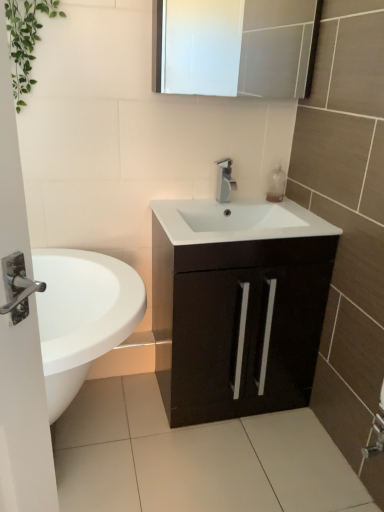
What do you see at coordinates (234, 47) in the screenshot?
I see `white glossy medicine cabinet at upper center` at bounding box center [234, 47].

Describe the element at coordinates (276, 185) in the screenshot. I see `translucent plastic soap dispenser at upper right` at that location.

Identify the location of silver metallic faucet at center. (224, 180).

In order to face silver metallic faucet at center, should I rotate leftwards or rightwards?

A 4.824 degree turn to the right will do.

The height and width of the screenshot is (512, 384). Find the location of `green leafy plant at upper left`. green leafy plant at upper left is located at coordinates (25, 40).

Identify the location of white glossy medicine cabinet at upper center. (234, 47).

Considering the relative positions of green leafy plant at upper left and matte black cabinet at center in the image provided, is green leafy plant at upper left to the left or to the right of matte black cabinet at center?

Clearly, green leafy plant at upper left is on the left of matte black cabinet at center in the image.

Considering the sizes of objects green leafy plant at upper left and matte black cabinet at center in the image provided, who is thinner, green leafy plant at upper left or matte black cabinet at center?

green leafy plant at upper left.

Is green leafy plant at upper left shorter than matte black cabinet at center?

Yes.

In the scene shown: Is silver metallic faucet at center touching green leafy plant at upper left?

No.

What's the angular difference between silver metallic faucet at center and green leafy plant at upper left's facing directions?

They differ by 3.32 degrees in their facing directions.

In the scene shown: Is green leafy plant at upper left at the back of silver metallic faucet at center?

That's not correct — silver metallic faucet at center is not looking away from green leafy plant at upper left.

Can you confirm if silver metallic faucet at center is shorter than green leafy plant at upper left?

Correct, silver metallic faucet at center is not as tall as green leafy plant at upper left.

Considering the relative sizes of silver metallic faucet at center and white glossy medicine cabinet at upper center in the image provided, is silver metallic faucet at center taller than white glossy medicine cabinet at upper center?

No.

From a real-world perspective, which object stands above the other?

white glossy medicine cabinet at upper center, from a real-world perspective.

Is silver metallic faucet at center not close to white glossy medicine cabinet at upper center?

No, silver metallic faucet at center is in close proximity to white glossy medicine cabinet at upper center.

Who is more distant, silver metallic faucet at center or white glossy medicine cabinet at upper center?

silver metallic faucet at center is further away from the camera.

Is translucent plastic soap dispenser at upper right inside matte black cabinet at center?

Definitely not — translucent plastic soap dispenser at upper right is not inside matte black cabinet at center.

Is point (183, 265) in front of point (269, 192)?

Yes, it is.

From a real-world perspective, relative to translucent plastic soap dispenser at upper right, is matte black cabinet at center vertically above or below?

In terms of real-world spatial position, matte black cabinet at center is below translucent plastic soap dispenser at upper right.

Which object is positioned more to the right, matte black cabinet at center or translucent plastic soap dispenser at upper right?

translucent plastic soap dispenser at upper right is more to the right.

The width and height of the screenshot is (384, 512). I want to click on tap above the matte black cabinet at center (from the image's perspective), so pyautogui.click(x=224, y=180).

How much distance is there between matte black cabinet at center and silver metallic faucet at center?

matte black cabinet at center and silver metallic faucet at center are 24.17 inches apart from each other.

Is matte black cabinet at center shorter than silver metallic faucet at center?

Incorrect, the height of matte black cabinet at center does not fall short of that of silver metallic faucet at center.

From a real-world perspective, is matte black cabinet at center physically below white glossy medicine cabinet at upper center?

Yes, from a real-world perspective, matte black cabinet at center is below white glossy medicine cabinet at upper center.

Where is `medicine cabinet behind the matte black cabinet at center`? medicine cabinet behind the matte black cabinet at center is located at coordinates (234, 47).

Is white glossy medicine cabinet at upper center at the back of matte black cabinet at center?

No, matte black cabinet at center is not facing the opposite direction of white glossy medicine cabinet at upper center.

From a real-world perspective, between translucent plastic soap dispenser at upper right and matte black cabinet at center, who is vertically lower?

matte black cabinet at center is physically lower.

At what (x,y) coordinates should I click in order to perform the action: click on bathroom cabinet below the translucent plastic soap dispenser at upper right (from the image's perspective). Please return your answer as a coordinate pair (x, y). This screenshot has width=384, height=512. Looking at the image, I should click on (237, 323).

Considering the relative sizes of translucent plastic soap dispenser at upper right and matte black cabinet at center in the image provided, is translucent plastic soap dispenser at upper right wider than matte black cabinet at center?

No, translucent plastic soap dispenser at upper right is not wider than matte black cabinet at center.

Identify the location of bathroom cabinet behind the green leafy plant at upper left. This screenshot has width=384, height=512. (237, 323).

The width and height of the screenshot is (384, 512). Find the location of `tap that is on the right side of green leafy plant at upper left`. tap that is on the right side of green leafy plant at upper left is located at coordinates (224, 180).

Looking at the image, which one is located further to matte black cabinet at center, translucent plastic soap dispenser at upper right or silver metallic faucet at center?

Among the two, translucent plastic soap dispenser at upper right is located further to matte black cabinet at center.

Which object lies further to the anchor point translucent plastic soap dispenser at upper right, white glossy medicine cabinet at upper center or silver metallic faucet at center?

white glossy medicine cabinet at upper center lies further to translucent plastic soap dispenser at upper right than the other object.

From the image, which object appears to be nearer to white glossy medicine cabinet at upper center, silver metallic faucet at center or matte black cabinet at center?

silver metallic faucet at center is closer to white glossy medicine cabinet at upper center.

From the picture: Looking at the image, which one is located closer to white glossy medicine cabinet at upper center, translucent plastic soap dispenser at upper right or matte black cabinet at center?

Based on the image, translucent plastic soap dispenser at upper right appears to be nearer to white glossy medicine cabinet at upper center.

When comparing their distances from silver metallic faucet at center, does translucent plastic soap dispenser at upper right or green leafy plant at upper left seem further?

green leafy plant at upper left is positioned further to the anchor silver metallic faucet at center.

Estimate the real-world distances between objects in this image. Which object is further from silver metallic faucet at center, matte black cabinet at center or green leafy plant at upper left?

Among the two, green leafy plant at upper left is located further to silver metallic faucet at center.

When comparing their distances from green leafy plant at upper left, does matte black cabinet at center or translucent plastic soap dispenser at upper right seem closer?

matte black cabinet at center lies closer to green leafy plant at upper left than the other object.

When comparing their distances from silver metallic faucet at center, does translucent plastic soap dispenser at upper right or matte black cabinet at center seem further?

matte black cabinet at center lies further to silver metallic faucet at center than the other object.

This screenshot has width=384, height=512. I want to click on tap between translucent plastic soap dispenser at upper right and matte black cabinet at center vertically, so click(224, 180).

I want to click on soap dispenser between white glossy medicine cabinet at upper center and silver metallic faucet at center in the vertical direction, so click(276, 185).

Locate an element on the screen. tap between green leafy plant at upper left and white glossy medicine cabinet at upper center is located at coordinates (224, 180).

Locate an element on the screen. Image resolution: width=384 pixels, height=512 pixels. tap between green leafy plant at upper left and matte black cabinet at center vertically is located at coordinates (224, 180).